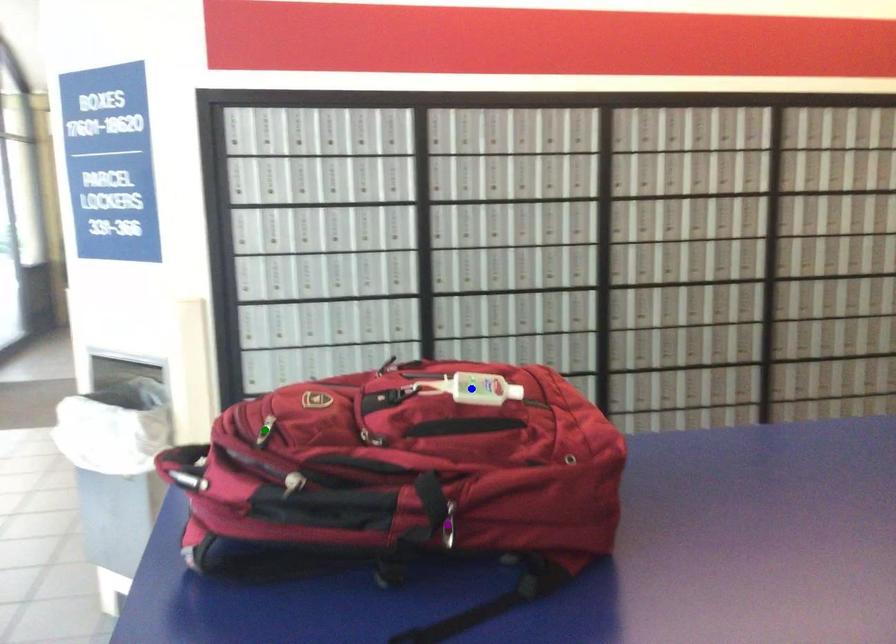
Order these from nearest to farthest:
- green point
- purple point
- blue point

purple point → green point → blue point